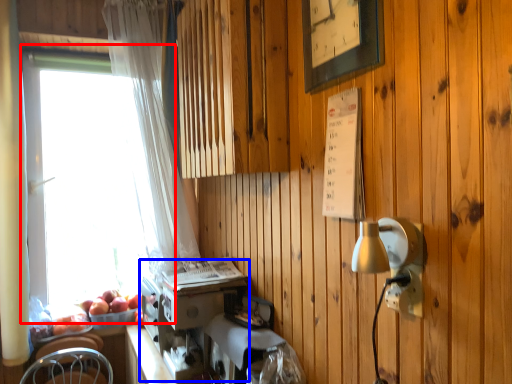
Question: Among these objects, which one is nearest to the camera, window (highlighted by a red box) or coffee machine (highlighted by a blue box)?

Choices:
 (A) window
 (B) coffee machine

Answer: (B)